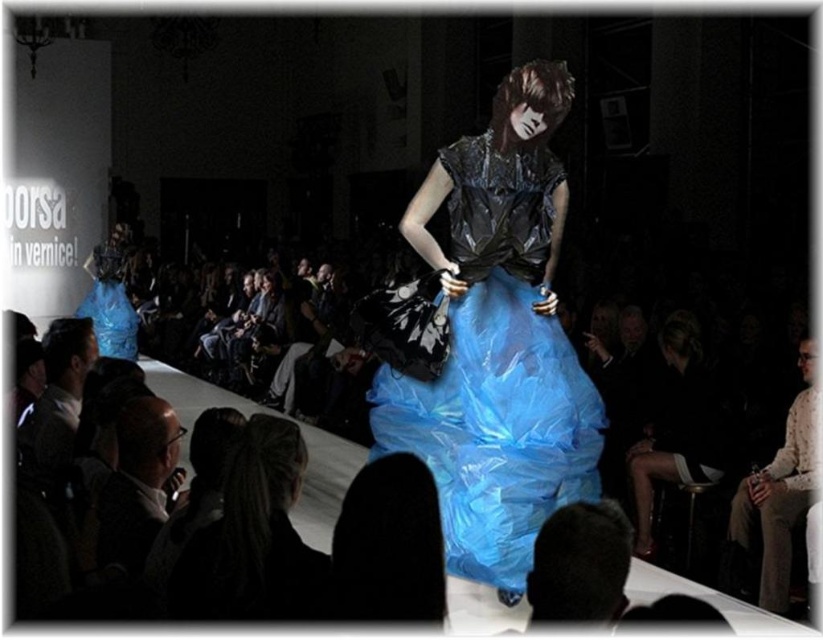
You are a photographer positioned at the front of the runway. You need to capture a closeup shot of the translucent blue fabric dress at center. Given that your camera can focus on objects within a 0.5 radius from your position at point 0.5, 0.5, will the dress be in focus?

The translucent blue fabric dress at center is located at point (496, 374). The distance from your position at (411, 320) is sqrt

You are a fashion designer observing the runway show. You notice the light blue tulle skirt at center and the translucent blue dress at center. Which one has a more slender silhouette?

The light blue tulle skirt at center is thinner than the translucent blue dress at center, so it has a more slender silhouette.